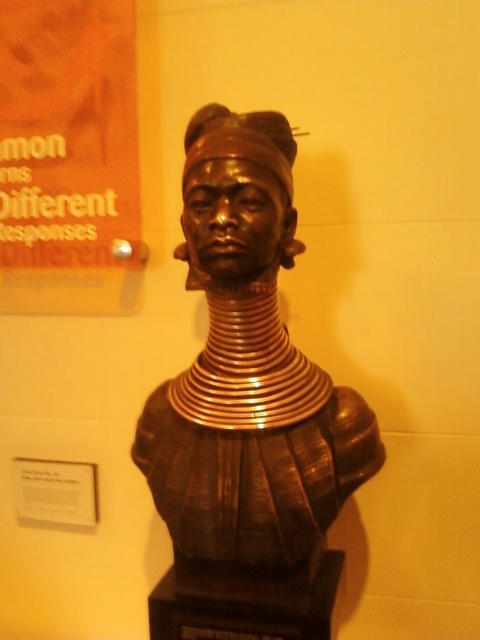
Does bronze/textured head at center lie behind white paper at lower left?

No, bronze/textured head at center is in front of white paper at lower left.

Find the location of a particular element. This screenshot has height=640, width=480. bronze/textured head at center is located at coordinates (238, 200).

Identify the location of bronze statue at center. This screenshot has width=480, height=640. (251, 480).

Can you confirm if bronze statue at center is thinner than gold metallic necklaces at center?

No, bronze statue at center is not thinner than gold metallic necklaces at center.

Does point (216, 600) lie behind point (252, 348)?

Yes.

Where is `bronze statue at center`? bronze statue at center is located at coordinates (251, 480).

Describe the element at coordinates (251, 480) in the screenshot. This screenshot has width=480, height=640. I see `bronze statue at center` at that location.

The width and height of the screenshot is (480, 640). What are the coordinates of `bronze statue at center` in the screenshot? It's located at (251, 480).